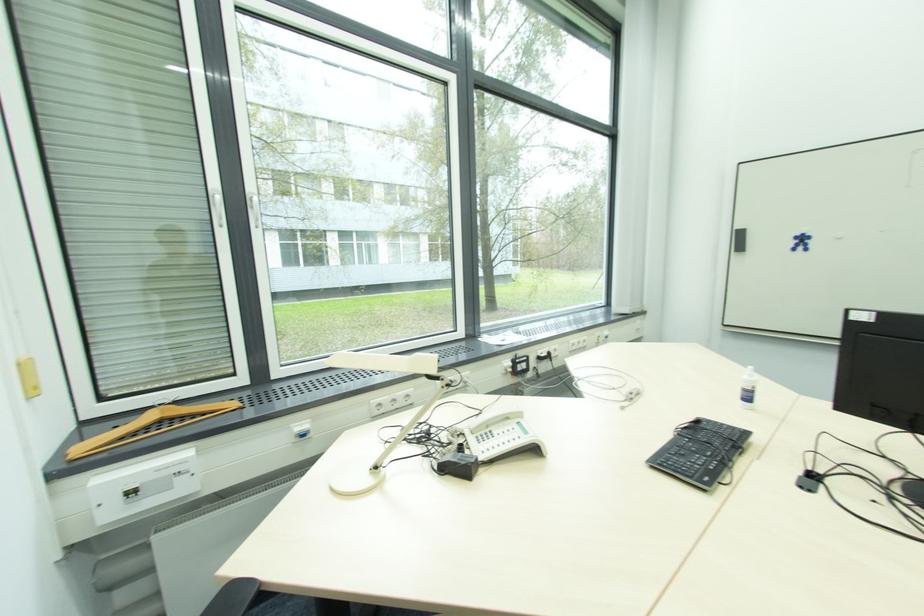
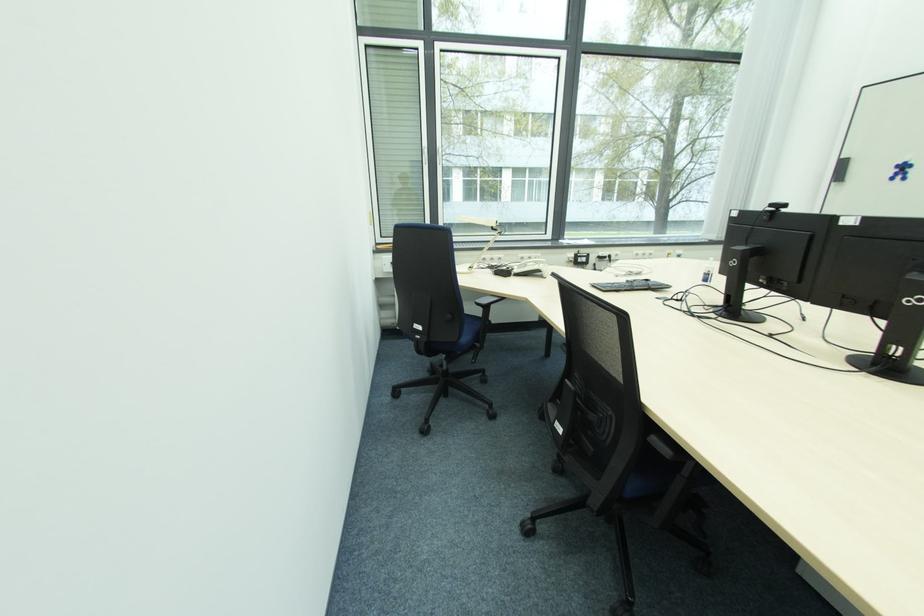
The point at (758, 390) is marked in the first image. Where is the corresponding point in the second image?

(712, 274)